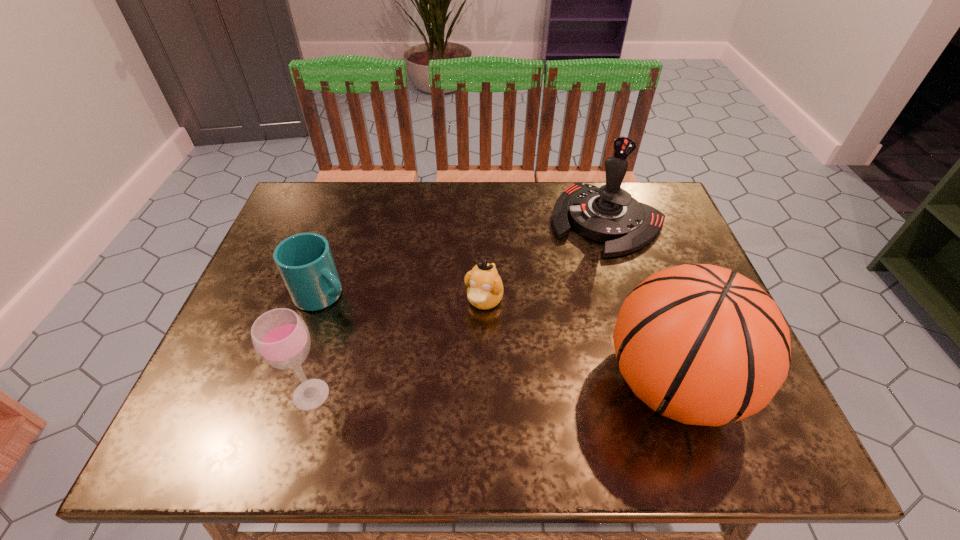
At what (x,y) coordinates should I click in order to perform the action: click on blank space located on the handle side of the cup. Please return your answer as a coordinate pair (x, y). The image size is (960, 540). Looking at the image, I should click on (445, 363).

You are a GUI agent. You are given a task and a screenshot of the screen. Output one action in this format:
    pyautogui.click(x=<x>, y=<y>)
    Task: Click on the vacant region located on the handle side of the cup
    The image size is (960, 540).
    Given the screenshot: What is the action you would take?
    pyautogui.click(x=461, y=372)

The height and width of the screenshot is (540, 960). What are the coordinates of `vacant space located on the face of the third object from left to right` in the screenshot? It's located at (463, 349).

You are a GUI agent. You are given a task and a screenshot of the screen. Output one action in this format:
    pyautogui.click(x=<x>, y=<y>)
    Task: Click on the free space located 0.090m on the face of the third object from left to right
    
    Given the screenshot: What is the action you would take?
    pyautogui.click(x=463, y=349)

Locate an element on the screen. vacant space positioned on the face of the third object from left to right is located at coordinates (461, 353).

This screenshot has height=540, width=960. Find the location of `object that is at the far edge`. object that is at the far edge is located at coordinates (609, 214).

The height and width of the screenshot is (540, 960). Find the location of `wineglass located at the near edge`. wineglass located at the near edge is located at coordinates (280, 337).

Locate an element on the screen. Image resolution: width=960 pixels, height=540 pixels. basketball present at the near edge is located at coordinates (702, 345).

Where is `object that is at the left edge`? object that is at the left edge is located at coordinates (305, 262).

Identify the location of basketball at the right edge. Image resolution: width=960 pixels, height=540 pixels. (702, 345).